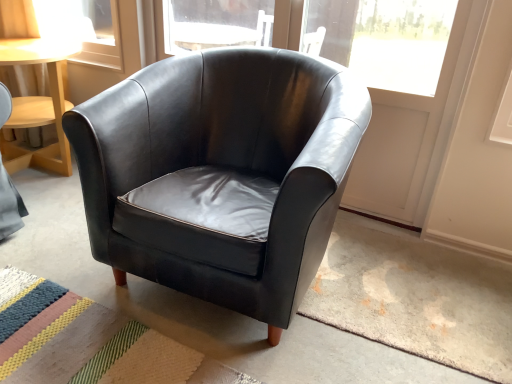
At what (x,y) coordinates should I click in order to perform the action: click on free space above striped woven mat at lower left (from a real-world perspective). Please return your answer as a coordinate pair (x, y). Looking at the image, I should click on (90, 336).